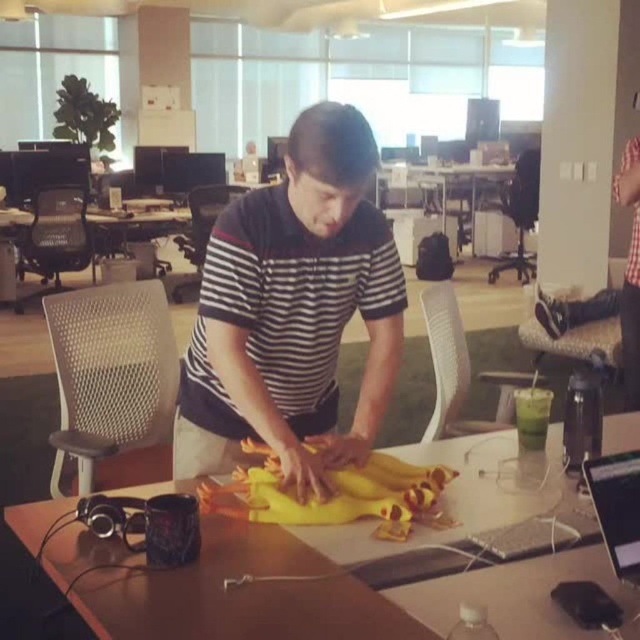
Question: Can you confirm if yellow fabric at center is thinner than silver metallic laptop at center?

Choices:
 (A) no
 (B) yes

Answer: (A)

Question: Which point is closer to the camera?

Choices:
 (A) (273, 484)
 (B) (365, 129)
 (C) (632, 454)

Answer: (C)

Question: Does yellow fabric at center appear on the right side of yellow rubber duck at center?

Choices:
 (A) yes
 (B) no

Answer: (A)

Question: Does striped cotton shirt at center have a greater width compared to yellow fabric at center?

Choices:
 (A) no
 (B) yes

Answer: (A)

Question: Which point appears farthest from the camera in this image?

Choices:
 (A) (108, 580)
 (B) (632, 483)

Answer: (B)

Question: Estimate the real-world distances between objects in this image. Which object is farther from the yellow fabric at center?

Choices:
 (A) silver metallic laptop at center
 (B) yellow rubber duck at center

Answer: (A)